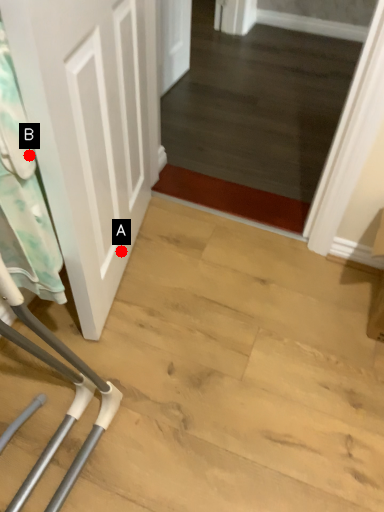
Question: Two points are circled on the image, labeled by A and B beside each circle. Which point appears closest to the camera in this image?

Choices:
 (A) A is closer
 (B) B is closer

Answer: (B)